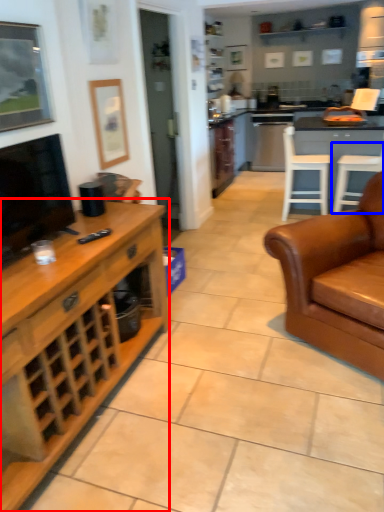
Question: Among these objects, which one is nearest to the camera, cabinetry (highlighted by a red box) or chair (highlighted by a blue box)?

Choices:
 (A) cabinetry
 (B) chair

Answer: (A)